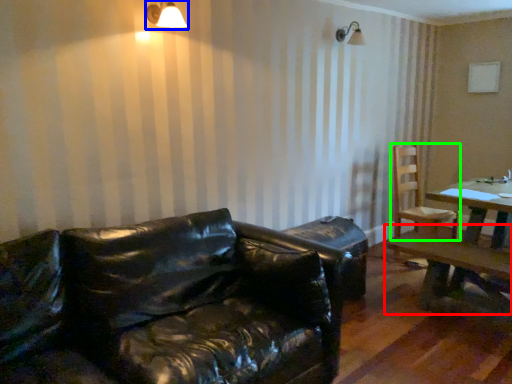
Question: Which object is positioned closest to table (highlighted by a red box)? Select from light fixture (highlighted by a blue box) and chair (highlighted by a green box).

Choices:
 (A) light fixture
 (B) chair

Answer: (B)